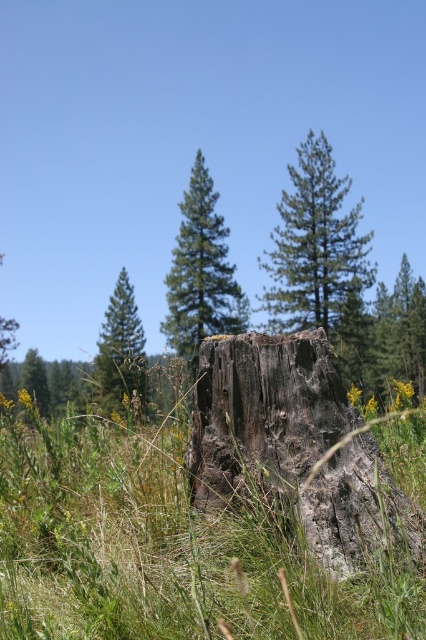
From the picture: Between green rough bark tree at center and green rough bark tree at upper left, which one has less height?

green rough bark tree at upper left is shorter.

Is green rough bark tree at center wider than green rough bark tree at upper left?

In fact, green rough bark tree at center might be narrower than green rough bark tree at upper left.

I want to click on green rough bark tree at center, so click(x=201, y=273).

The image size is (426, 640). I want to click on green grass at center, so click(161, 552).

Consider the image. Who is more distant from viewer, (57, 493) or (187, 305)?

The point (187, 305) is more distant.

Does point (2, 552) lie in front of point (187, 221)?

Yes.

Identify the location of green grass at center. The height and width of the screenshot is (640, 426). (161, 552).

Which is below, green needle-like tree at upper center or green rough tree stump at left?

green rough tree stump at left is below.

What are the coordinates of `green needle-like tree at upper center` in the screenshot? It's located at (316, 246).